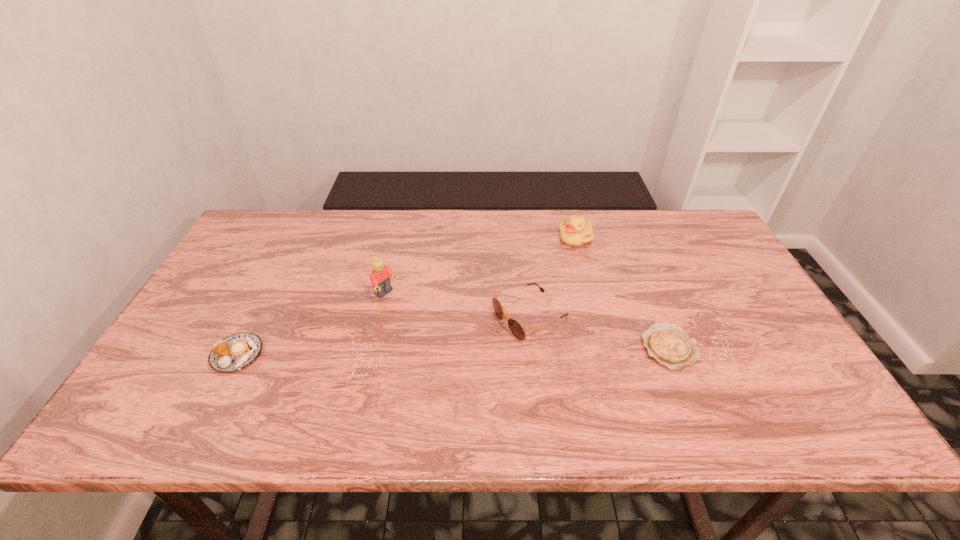
At what (x,y) coordinates should I click in order to perform the action: click on the leftmost object. Please return your answer as a coordinate pair (x, y). Looking at the image, I should click on (237, 351).

Where is `pastry`? pastry is located at coordinates (237, 351).

This screenshot has width=960, height=540. I want to click on the rightmost object, so tap(668, 344).

The image size is (960, 540). I want to click on quiche, so click(668, 344).

In order to click on the third shortest object in this screenshot , I will do `click(515, 327)`.

You are a GUI agent. You are given a task and a screenshot of the screen. Output one action in this format:
    pyautogui.click(x=<x>, y=<y>)
    Task: Click on the third object from right to left
    The height and width of the screenshot is (540, 960).
    Given the screenshot: What is the action you would take?
    pyautogui.click(x=515, y=327)

Identify the location of duckling. (577, 231).

Where is `the farthest object`? The image size is (960, 540). the farthest object is located at coordinates (577, 231).

Where is `the tallest object`? The height and width of the screenshot is (540, 960). the tallest object is located at coordinates (380, 279).

Identify the location of the fourth object from right to left. The image size is (960, 540). (380, 279).